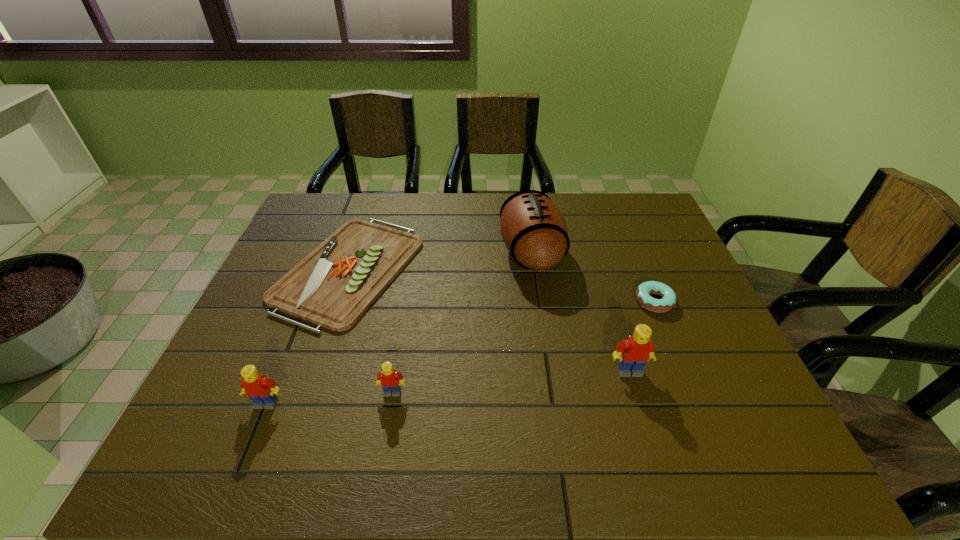
This screenshot has height=540, width=960. I want to click on spot to insert another Lego for uniform distribution, so click(514, 381).